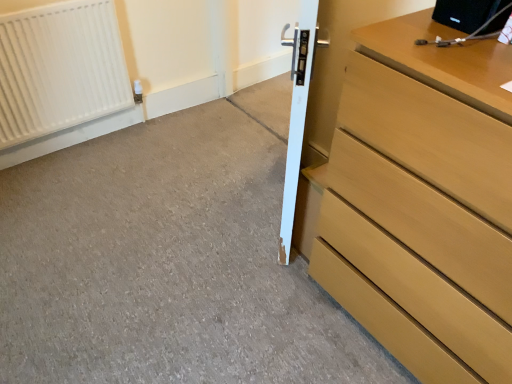
Question: Is point (425, 105) positioned closer to the camera than point (232, 276)?

Choices:
 (A) farther
 (B) closer

Answer: (B)

Question: Based on their positions, is light brown wood chest of drawers at right located to the left or right of smooth concrete at center?

Choices:
 (A) left
 (B) right

Answer: (B)

Question: Which is nearer to the light brown wood chest of drawers at right?

Choices:
 (A) smooth concrete at center
 (B) white glossy door at center
 (C) white matte radiator at upper left

Answer: (B)

Question: Estimate the real-world distances between objects in this image. Which object is farther from the light brown wood chest of drawers at right?

Choices:
 (A) smooth concrete at center
 (B) white matte radiator at upper left
 (C) white glossy door at center

Answer: (B)